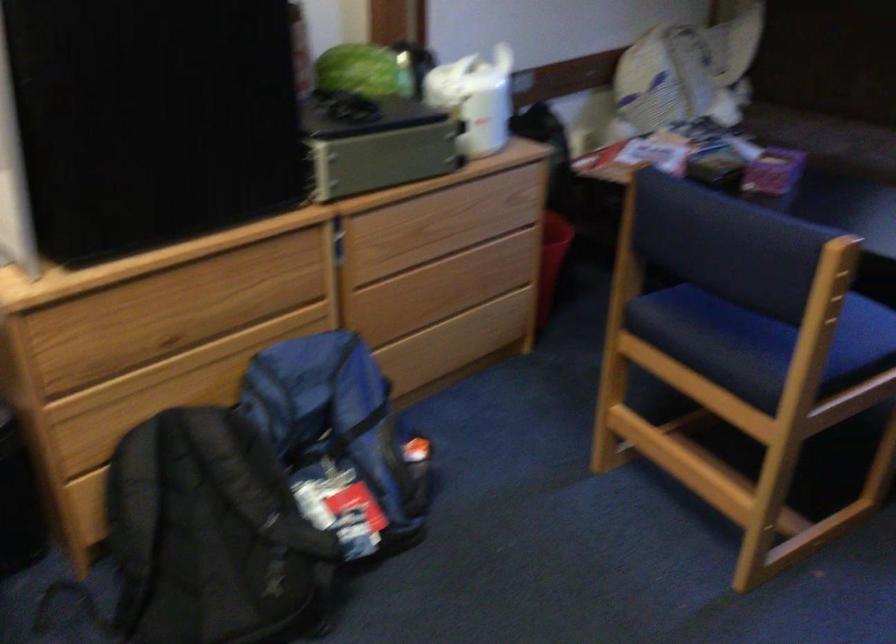
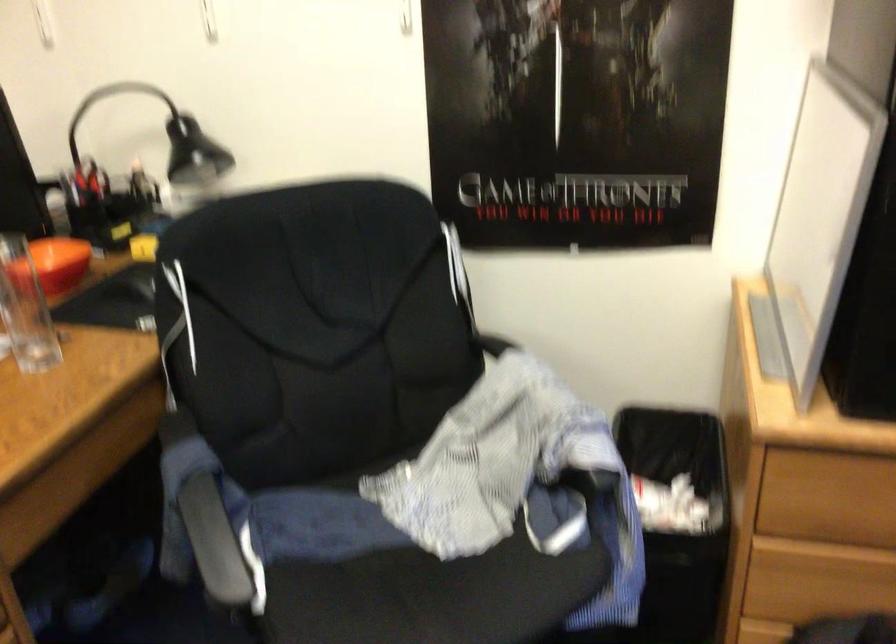
Question: The images are taken continuously from a first-person perspective. In which direction is your viewpoint rotating?

Choices:
 (A) Left
 (B) Right
 (C) Up
 (D) Down

Answer: (A)